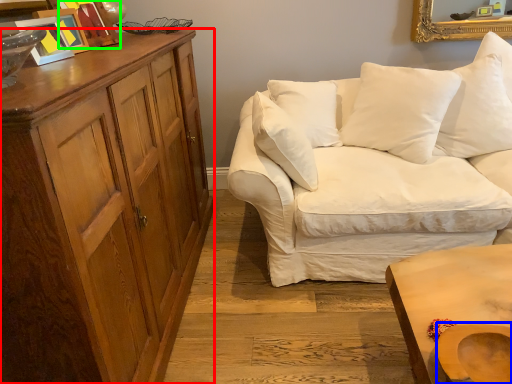
Question: Which object is the farthest from cabinetry (highlighted by a red box)? Choose among these: swivel chair (highlighted by a blue box) or picture frame (highlighted by a green box).

Choices:
 (A) swivel chair
 (B) picture frame

Answer: (A)